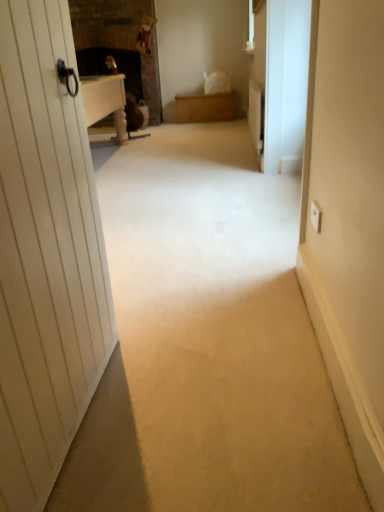
Question: Does polished brass door handle at upper left turn towards wooden chest at center?

Choices:
 (A) no
 (B) yes

Answer: (B)

Question: Can you confirm if polished brass door handle at upper left is smaller than wooden chest at center?

Choices:
 (A) yes
 (B) no

Answer: (A)

Question: From a real-world perspective, does polished brass door handle at upper left sit lower than wooden chest at center?

Choices:
 (A) no
 (B) yes

Answer: (A)

Question: From a real-world perspective, is polished brass door handle at upper left positioned over wooden chest at center based on gravity?

Choices:
 (A) no
 (B) yes

Answer: (B)

Question: Is polished brass door handle at upper left wider than wooden chest at center?

Choices:
 (A) no
 (B) yes

Answer: (A)

Question: Looking at their shapes, would you say wooden chest at center is wider or thinner than polished brass door handle at upper left?

Choices:
 (A) wide
 (B) thin

Answer: (A)

Question: From the image's perspective, relative to polished brass door handle at upper left, is wooden chest at center above or below?

Choices:
 (A) above
 (B) below

Answer: (B)

Question: In the image, is wooden chest at center on the left side or the right side of polished brass door handle at upper left?

Choices:
 (A) right
 (B) left

Answer: (A)

Question: In terms of height, does wooden chest at center look taller or shorter compared to polished brass door handle at upper left?

Choices:
 (A) tall
 (B) short

Answer: (B)

Question: Relative to polished brass door handle at upper left, is white matte screen door at right in front or behind?

Choices:
 (A) behind
 (B) front

Answer: (B)

Question: Is white matte screen door at right bigger or smaller than polished brass door handle at upper left?

Choices:
 (A) small
 (B) big

Answer: (B)

Question: Is point (296, 37) closer or farther from the camera than point (74, 78)?

Choices:
 (A) closer
 (B) farther

Answer: (B)

Question: Is white matte screen door at right taller or shorter than polished brass door handle at upper left?

Choices:
 (A) short
 (B) tall

Answer: (B)

Question: Which is correct: wooden chest at center is inside white matte screen door at right, or outside of it?

Choices:
 (A) inside
 (B) outside

Answer: (B)

Question: Is wooden chest at center wider or thinner than white matte screen door at right?

Choices:
 (A) wide
 (B) thin

Answer: (A)